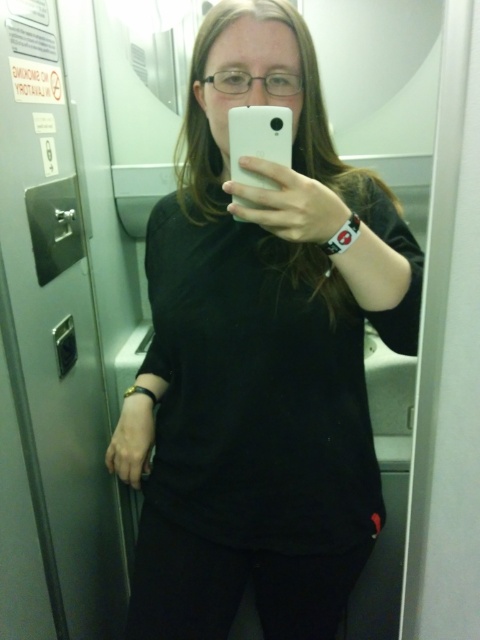
You are a photographer analyzing this image. You need to determine if the black matte shirt at center is positioned higher than the white matte phone at center. Based on the scene, can you confirm this?

The black matte shirt at center is taller than the white matte phone at center, so yes, the black matte shirt at center is positioned higher than the white matte phone at center.